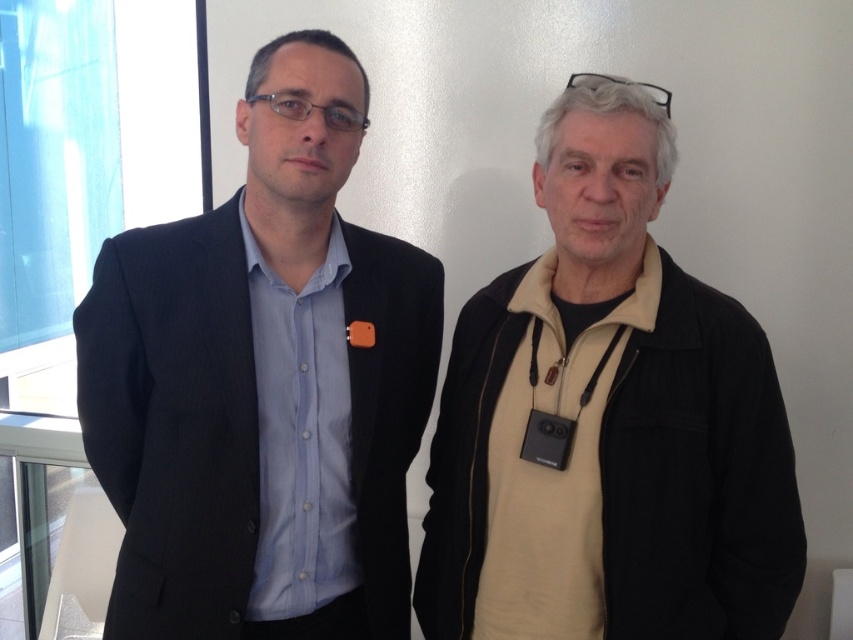
You are standing in a room and see the matte black suit at left and the beige fleece at right. Which object is positioned more to the left side of the room?

The matte black suit at left is positioned more to the left side of the room than the beige fleece at right.